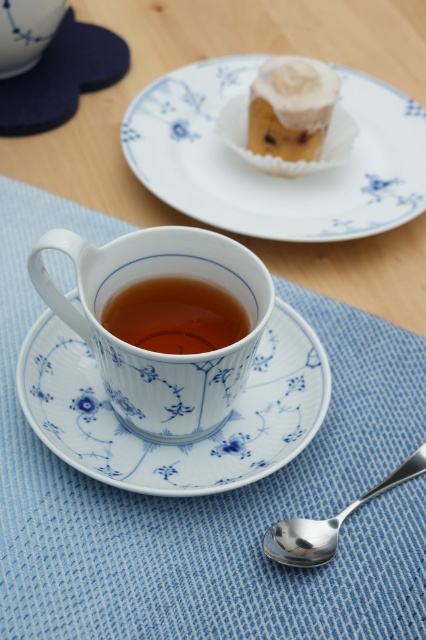
Question: Where is white porcelain plate at upper center located in relation to silver metallic spoon at lower right in the image?

Choices:
 (A) left
 (B) right

Answer: (A)

Question: Which point is closer to the camera?

Choices:
 (A) (94, 218)
 (B) (291, 436)
 (C) (305, 148)

Answer: (B)

Question: In this image, where is white porcelain plate at upper center located relative to white porcelain saucer at center?

Choices:
 (A) below
 (B) above

Answer: (B)

Question: Which is nearer to the white frosted cake at upper center?

Choices:
 (A) blue woven placemat at lower center
 (B) white porcelain plate at upper center
 (C) white porcelain saucer at center

Answer: (B)

Question: Is white porcelain saucer at center thinner than white porcelain cup at center?

Choices:
 (A) no
 (B) yes

Answer: (A)

Question: Based on their relative distances, which object is nearer to the brown glossy cup at center?

Choices:
 (A) white frosted cake at upper center
 (B) blue woven placemat at lower center

Answer: (B)